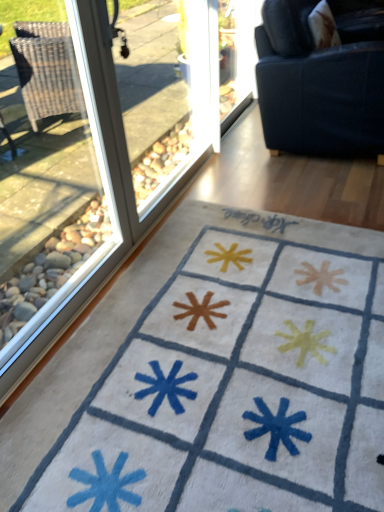
Question: In terms of size, does transparent glass window at left appear bigger or smaller than dark blue fabric couch at upper right?

Choices:
 (A) small
 (B) big

Answer: (A)

Question: From a real-world perspective, is transparent glass window at left positioned above or below dark blue fabric couch at upper right?

Choices:
 (A) below
 (B) above

Answer: (B)

Question: Estimate the real-world distances between objects in this image. Which object is closer to the white soft rug at lower center?

Choices:
 (A) dark blue fabric couch at upper right
 (B) transparent glass window at left
 (C) transparent glass screen door at upper center

Answer: (B)

Question: Which object is positioned farthest from the transparent glass window at left?

Choices:
 (A) transparent glass screen door at upper center
 (B) white soft rug at lower center
 (C) dark blue fabric couch at upper right

Answer: (A)